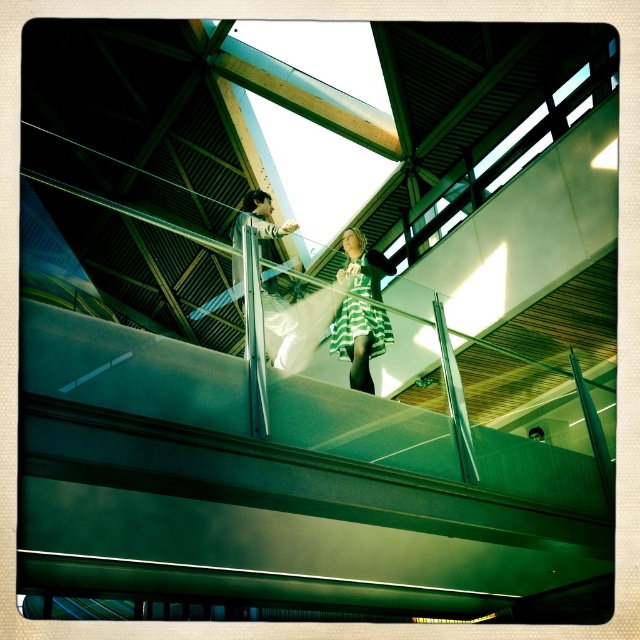
You are designing a new exhibit and need to place two mannequins wearing the striped jersey dress at center and the green striped dress at center side by side. Which dress requires more horizontal space between the mannequins?

The striped jersey dress at center requires more horizontal space between the mannequins because its width surpasses that of the green striped dress at center.

You are a photographer positioned at the bottom of the atrium, aiming to capture a photo of both the striped jersey dress at center and the green striped dress at center. Given that your camera has a maximum focus range of 20 inches, will you be able to focus on both subjects simultaneously?

The distance between the striped jersey dress at center and the green striped dress at center is 21.39 inches, which exceeds the camera focus range of 20 inches. Therefore, you cannot focus on both subjects simultaneously.

You are a photographer trying to capture a photo of both the striped jersey dress at center and the green striped dress at center from the angle shown in the scene. Based on their heights, which dress will appear taller in the photograph?

The striped jersey dress at center will appear taller in the photograph because it has a greater height compared to the green striped dress at center.